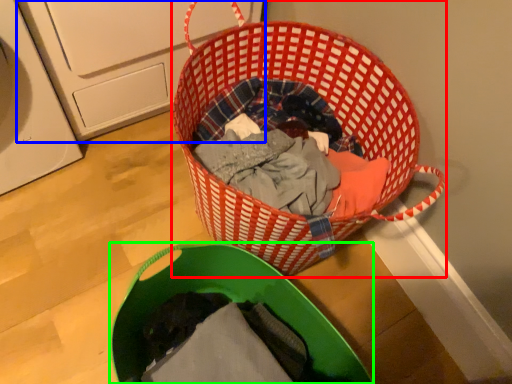
Question: Which object is the closest to the picnic basket (highlighted by a red box)? Choose among these: washing machine (highlighted by a blue box) or laundry basket (highlighted by a green box).

Choices:
 (A) washing machine
 (B) laundry basket

Answer: (B)